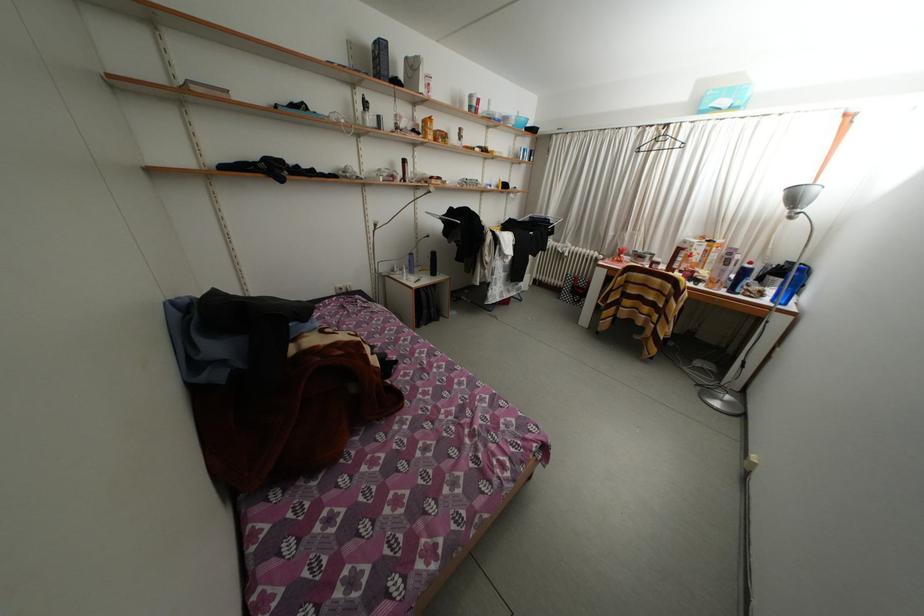
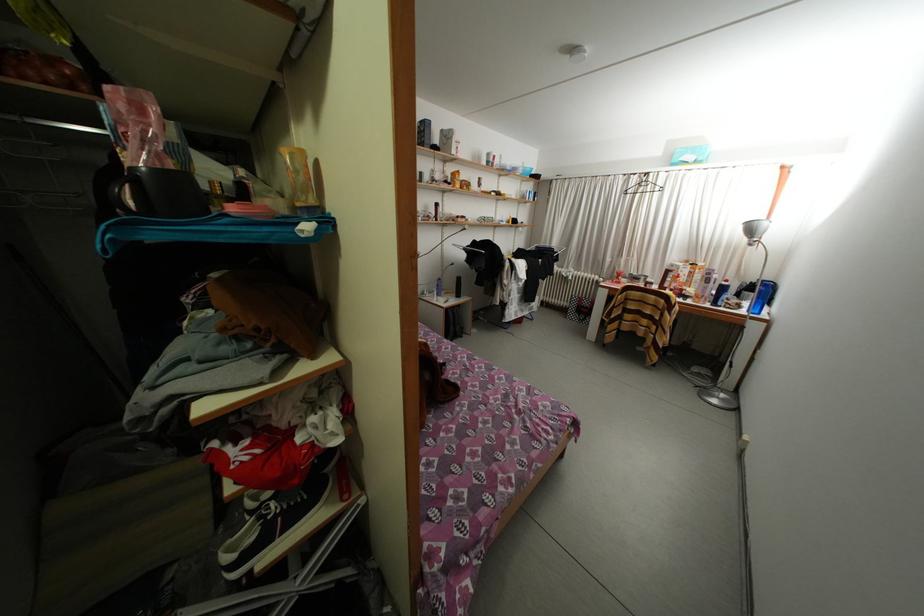
Where in the second image is the point corresponding to point (822, 195) from the first image?

(772, 229)